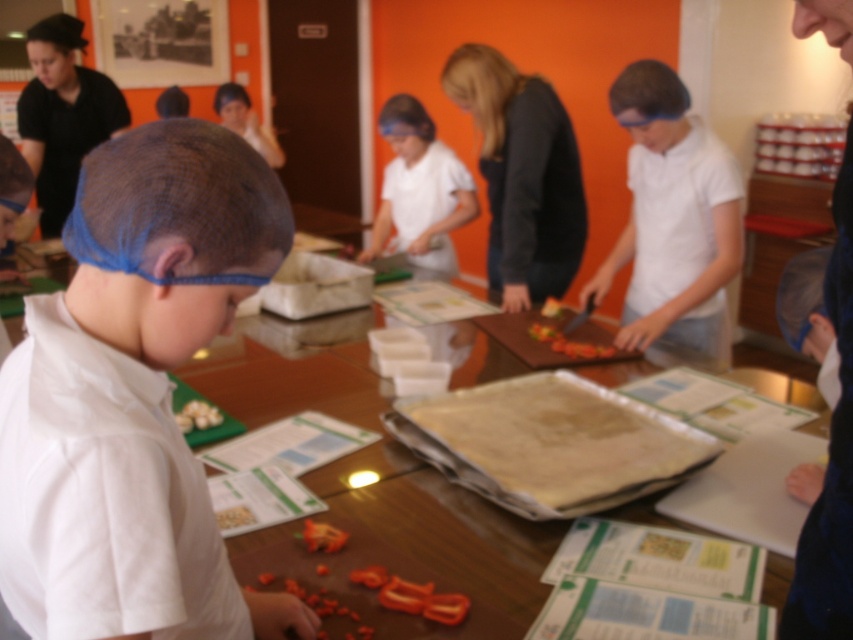
Question: Observing the image, what is the correct spatial positioning of wooden table at center in reference to red sliced bell pepper at center?

Choices:
 (A) above
 (B) below

Answer: (B)

Question: Which of these objects is positioned farthest from the wooden table at center?

Choices:
 (A) white matte shirt at center
 (B) dark gray sweater at center
 (C) white matte chef hat at center
 (D) white matte garlic at center

Answer: (B)

Question: Which object appears farthest from the camera in this image?

Choices:
 (A) white matte chef hat at center
 (B) red sliced bell pepper at center
 (C) smooth white cheese at center

Answer: (C)

Question: Is white matte garlic at center closer to the viewer compared to smooth white cheese at center?

Choices:
 (A) yes
 (B) no

Answer: (A)

Question: Based on their relative distances, which object is nearer to the white matte garlic at center?

Choices:
 (A) red sliced bell pepper at center
 (B) white matte chef hat at center

Answer: (A)

Question: Does wooden table at center appear over white matte garlic at center?

Choices:
 (A) no
 (B) yes

Answer: (B)